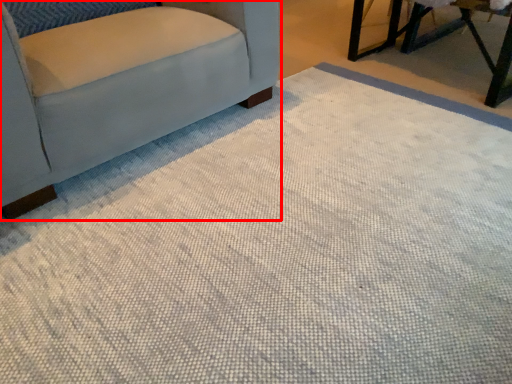
Question: From the image's perspective, what is the correct spatial positioning of chair (annotated by the red box) in reference to table?

Choices:
 (A) below
 (B) above

Answer: (A)